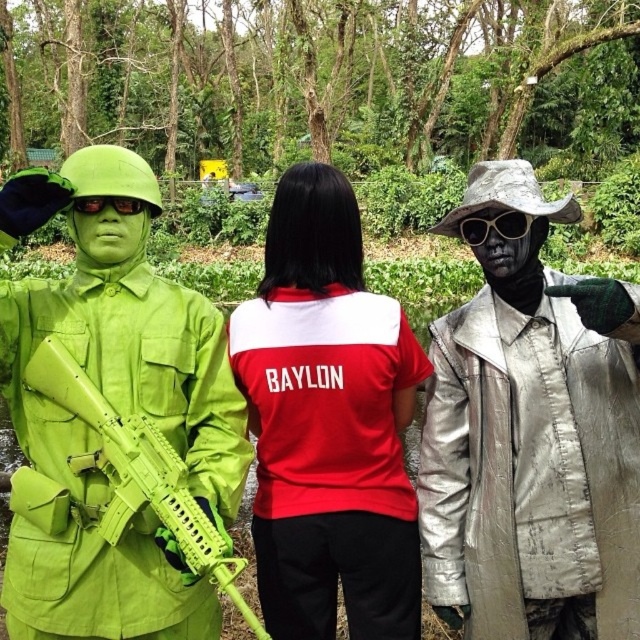
You are a photographer trying to capture a group photo of the metallic silver jacket at right and the lime green fabric uniform at left. The camera you have can only focus on objects within a 4 feet range. Will both subjects be in focus if you position yourself exactly between them?

The metallic silver jacket at right is 4.16 feet away from the lime green fabric uniform at left. If you position yourself exactly between them, the distance from you to each subject would be half of 4.16, which is 2.08 feet. Since 2.08 feet is within the 4 feet range, both subjects will be in focus.

You are a photographer trying to capture a group photo of the three individuals in the forest scene. Given that the lime green fabric uniform at left is positioned at coordinates approximately 0.637 on the x and 0.178 on the y axis, where should you place your camera to ensure all three are in frame?

Since the lime green fabric uniform at left is located at point (113, 406), you should position the camera centrally to include the entire area where all three individuals are standing, ensuring the lime green fabric uniform at left is within the frame along with the others.

You are a photographer trying to capture a photo of both the metallic silver jacket at right and the red matte shirt at center. Since you want both subjects to be in focus, which one should you focus on first to ensure the other is also in focus?

You should focus on the metallic silver jacket at right first because it is closer to the viewer than the red matte shirt at center. By focusing on the closer subject, the depth of field may extend to include the farther subject in acceptable focus.